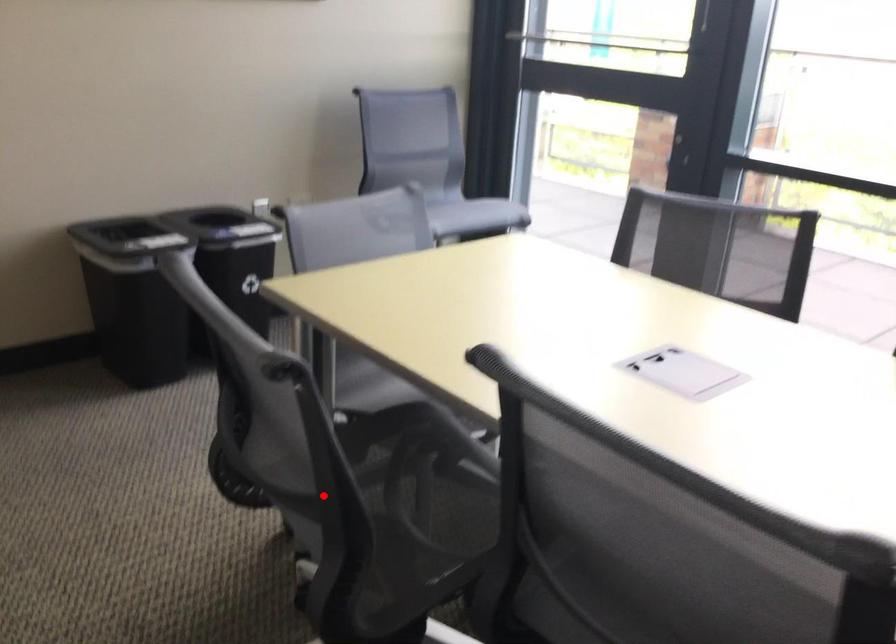
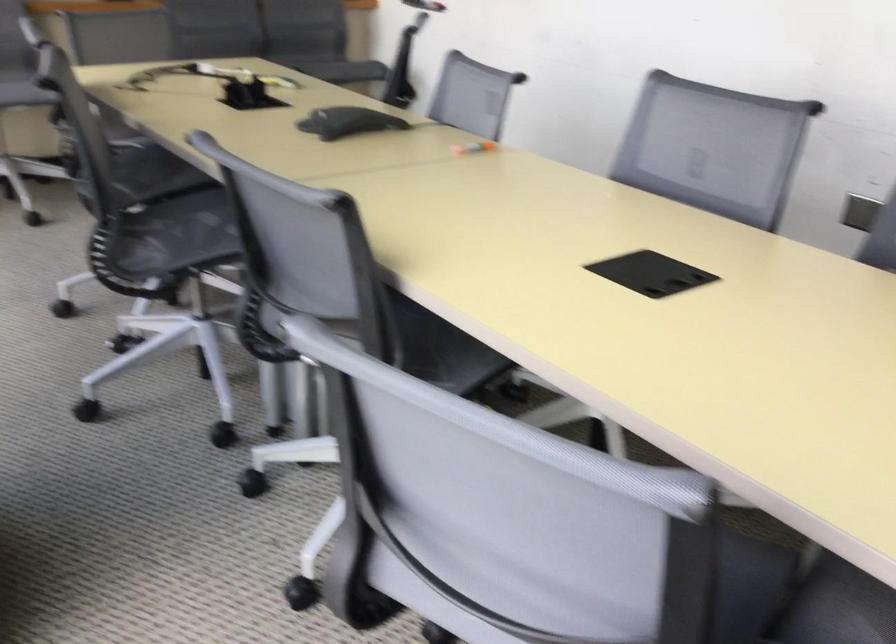
Where in the second image is the point corresponding to the highlighted location from the first image?

(879, 241)